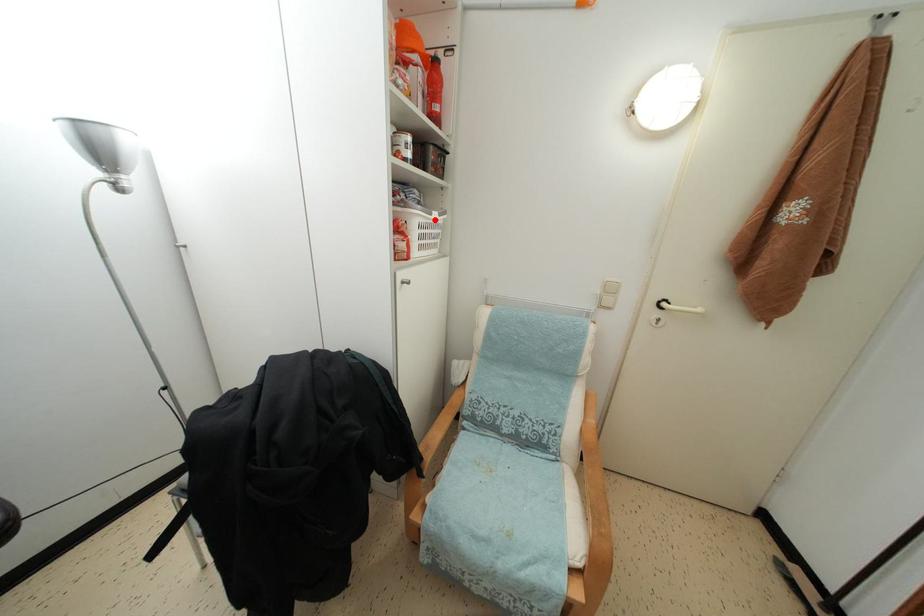
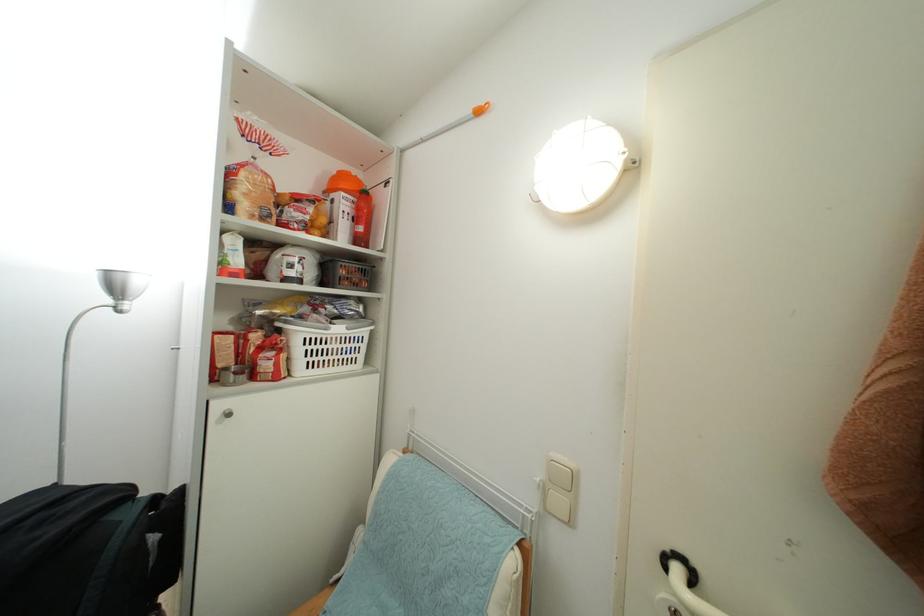
Find the pixel in the second image that matches the highlighted location in the first image.

(331, 334)